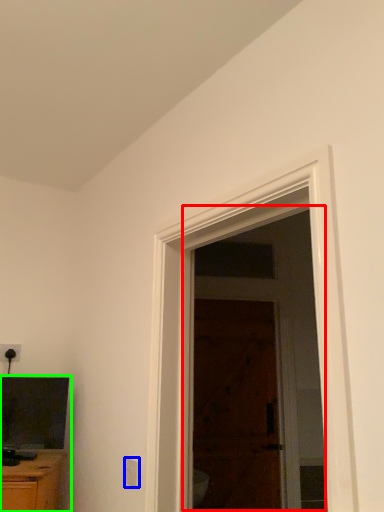
Question: Considering the real-world distances, which object is closest to screen door (highlighted by a red box)? electric outlet (highlighted by a blue box) or entertainment center (highlighted by a green box).

Choices:
 (A) electric outlet
 (B) entertainment center

Answer: (B)